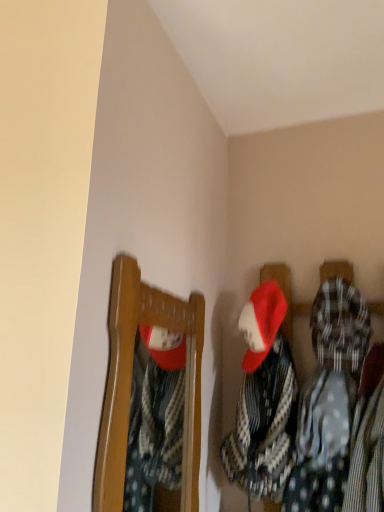
Where is `white dotted fabric at center`? white dotted fabric at center is located at coordinates (264, 426).

The image size is (384, 512). Describe the element at coordinates (264, 426) in the screenshot. I see `white dotted fabric at center` at that location.

The width and height of the screenshot is (384, 512). Describe the element at coordinates (131, 380) in the screenshot. I see `matte wooden mirror at upper left` at that location.

Find the location of a particular element. This screenshot has width=384, height=512. matte wooden mirror at upper left is located at coordinates (131, 380).

Measure the distance between point (133,298) and camera.

A distance of 34.72 inches exists between point (133,298) and camera.

The height and width of the screenshot is (512, 384). In order to click on white dotted fabric at center in this screenshot , I will do `click(264, 426)`.

Which object is positioned more to the right, white dotted fabric at center or matte wooden mirror at upper left?

white dotted fabric at center is more to the right.

Is white dotted fabric at center closer to camera compared to matte wooden mirror at upper left?

That is False.

Which is behind, point (255, 461) or point (128, 364)?

Positioned behind is point (255, 461).

From the image's perspective, relative to matte wooden mirror at upper left, is white dotted fabric at center above or below?

Clearly, from the image's perspective, white dotted fabric at center is below matte wooden mirror at upper left.

From a real-world perspective, is white dotted fabric at center positioned above or below matte wooden mirror at upper left?

white dotted fabric at center is below matte wooden mirror at upper left.

Is white dotted fabric at center wider than matte wooden mirror at upper left?

Yes.

Is white dotted fabric at center shorter than matte wooden mirror at upper left?

Yes, white dotted fabric at center is shorter than matte wooden mirror at upper left.

Is white dotted fabric at center bigger or smaller than matte wooden mirror at upper left?

In the image, white dotted fabric at center appears to be larger than matte wooden mirror at upper left.

Does white dotted fabric at center contain matte wooden mirror at upper left?

Definitely not — matte wooden mirror at upper left is not inside white dotted fabric at center.

Is white dotted fabric at center in contact with matte wooden mirror at upper left?

They are not placed beside each other.

From the picture: Could you tell me if white dotted fabric at center is facing matte wooden mirror at upper left?

No, white dotted fabric at center is not turned towards matte wooden mirror at upper left.

How many degrees apart are the facing directions of white dotted fabric at center and matte wooden mirror at upper left?

The angular difference between white dotted fabric at center and matte wooden mirror at upper left is 90.4 degrees.

This screenshot has height=512, width=384. Identify the location of furniture located in front of the white dotted fabric at center. (131, 380).

Is matte wooden mirror at upper left to the left of white dotted fabric at center from the viewer's perspective?

Yes.

Considering the positions of objects matte wooden mirror at upper left and white dotted fabric at center in the image provided, who is in front, matte wooden mirror at upper left or white dotted fabric at center?

matte wooden mirror at upper left.

Which is behind, point (104, 446) or point (270, 375)?

Positioned behind is point (270, 375).

From the image's perspective, which one is positioned lower, matte wooden mirror at upper left or white dotted fabric at center?

From the image's view, white dotted fabric at center is below.

From a real-world perspective, which is physically above, matte wooden mirror at upper left or white dotted fabric at center?

matte wooden mirror at upper left, from a real-world perspective.

Considering the relative sizes of matte wooden mirror at upper left and white dotted fabric at center in the image provided, is matte wooden mirror at upper left thinner than white dotted fabric at center?

Yes.

Which of these two, matte wooden mirror at upper left or white dotted fabric at center, stands shorter?

white dotted fabric at center.

In terms of size, does matte wooden mirror at upper left appear bigger or smaller than white dotted fabric at center?

Clearly, matte wooden mirror at upper left is smaller in size than white dotted fabric at center.

Would you say matte wooden mirror at upper left contains white dotted fabric at center?

Definitely not — white dotted fabric at center is not inside matte wooden mirror at upper left.

Is matte wooden mirror at upper left in contact with white dotted fabric at center?

No, matte wooden mirror at upper left is not in contact with white dotted fabric at center.

Does matte wooden mirror at upper left turn towards white dotted fabric at center?

Yes, matte wooden mirror at upper left is facing white dotted fabric at center.

What's the angular difference between matte wooden mirror at upper left and white dotted fabric at center's facing directions?

They differ by 90.4 degrees in their facing directions.

I want to click on furniture above the white dotted fabric at center (from the image's perspective), so click(131, 380).

This screenshot has width=384, height=512. In order to click on clothing below the matte wooden mirror at upper left (from the image's perspective) in this screenshot , I will do `click(264, 426)`.

Where is `clothing lying on the right of matte wooden mirror at upper left`? The height and width of the screenshot is (512, 384). clothing lying on the right of matte wooden mirror at upper left is located at coordinates (264, 426).